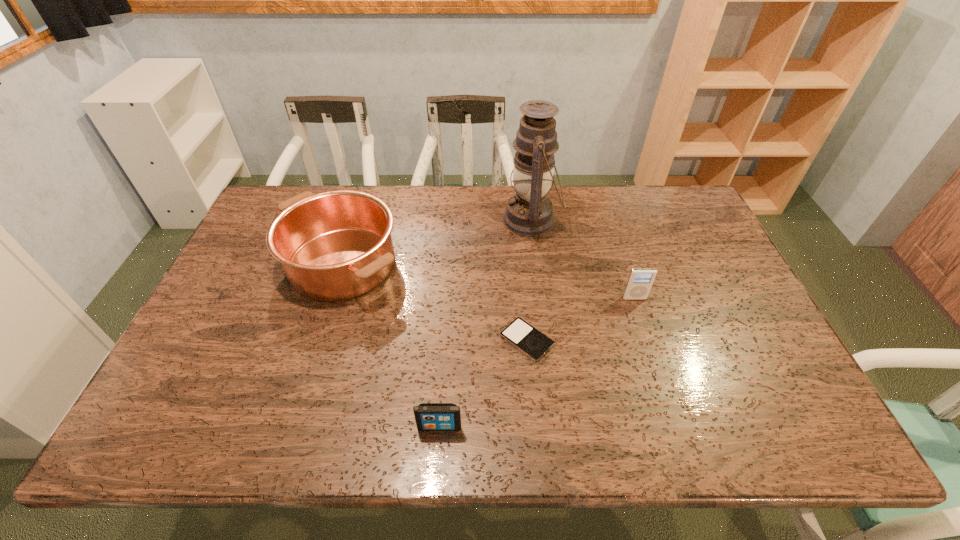
What are the coordinates of `vacant point at the right edge` in the screenshot? It's located at (790, 400).

At what (x,y) coordinates should I click in order to perform the action: click on free space at the near left corner of the desktop. Please return your answer as a coordinate pair (x, y). Image resolution: width=960 pixels, height=540 pixels. Looking at the image, I should click on (169, 433).

Image resolution: width=960 pixels, height=540 pixels. In order to click on vacant area between the second tallest object and the shortest object in this screenshot , I will do `click(435, 302)`.

Where is `vacant space that's between the farthest iPod and the tallest object`? The height and width of the screenshot is (540, 960). vacant space that's between the farthest iPod and the tallest object is located at coordinates (583, 259).

Where is `free point between the shortest object and the second shortest object`? free point between the shortest object and the second shortest object is located at coordinates (483, 383).

At what (x,y) coordinates should I click in order to perform the action: click on free spot between the oil lamp and the second nearest object. Please return your answer as a coordinate pair (x, y). The width and height of the screenshot is (960, 540). Looking at the image, I should click on 529,280.

The image size is (960, 540). Find the location of `unoccupied area between the second nearest iPod and the saucepan`. unoccupied area between the second nearest iPod and the saucepan is located at coordinates (435, 302).

The height and width of the screenshot is (540, 960). Identify the location of free area in between the oil lamp and the fourth tallest object. (486, 323).

Locate an element on the screen. The width and height of the screenshot is (960, 540). free spot between the second tallest iPod and the leftmost object is located at coordinates (391, 345).

In order to click on blank region between the saucepan and the second iPod from left to right in this screenshot , I will do `click(435, 302)`.